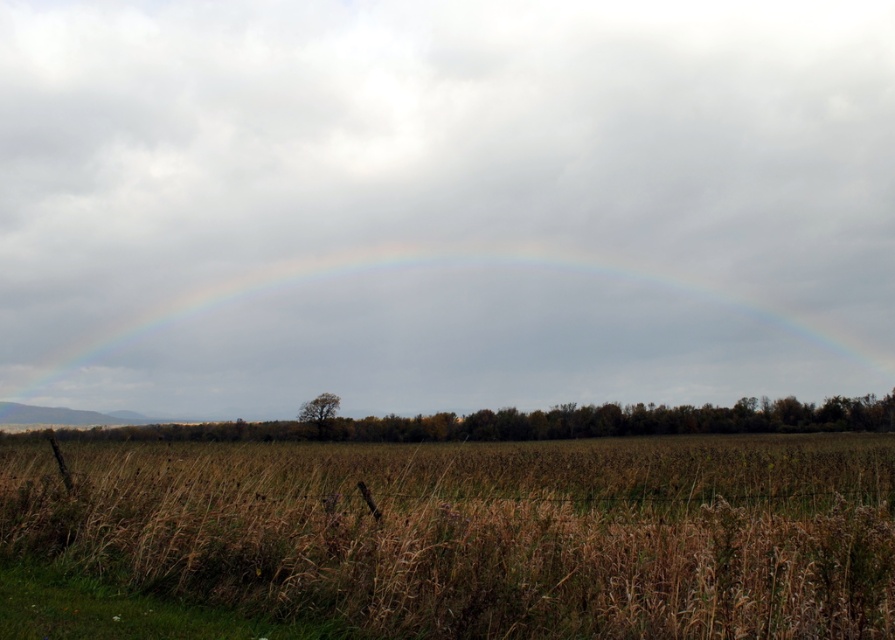
Based on the photo, you are standing in the field of golden brown grass and want to walk to the rainbow. Which point, point (567, 525) or point (364, 275), is closer to you?

Point (567, 525) is closer to the camera than point (364, 275), so you should head towards point (567, 525) first.

You are standing in the field and want to take a photo of the rainbow at center without the brown grass at lower center blocking the view. Is it possible to do so by moving forward?

The brown grass at lower center is in front of the rainbow at center, so moving forward might not help. You should move sideways or backward to position yourself where the brown grass at lower center is no longer blocking the rainbow at center.